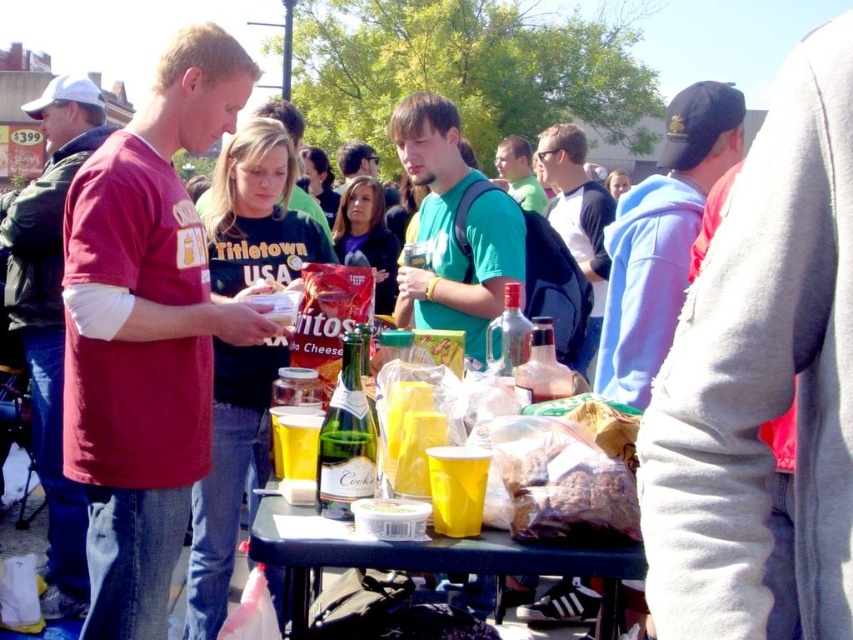
Is gray fleece sweatshirt at upper right below blue plastic table at center?

Incorrect, gray fleece sweatshirt at upper right is not positioned below blue plastic table at center.

Between gray fleece sweatshirt at upper right and blue plastic table at center, which one is positioned higher?

Positioned higher is gray fleece sweatshirt at upper right.

Which is behind, point (840, 188) or point (618, 572)?

Point (618, 572)

Where is `gray fleece sweatshirt at upper right`? This screenshot has height=640, width=853. gray fleece sweatshirt at upper right is located at coordinates (762, 378).

Does green matte shirt at center appear on the left side of green glass bottle at center?

No, green matte shirt at center is not to the left of green glass bottle at center.

Based on the photo, does green matte shirt at center have a lesser width compared to green glass bottle at center?

In fact, green matte shirt at center might be wider than green glass bottle at center.

Is point (486, 212) farther from viewer compared to point (334, 490)?

That is True.

The height and width of the screenshot is (640, 853). What are the coordinates of `green matte shirt at center` in the screenshot? It's located at point(453,227).

Which is more to the right, green glass bottle at center or green t-shirt at center?

green t-shirt at center

Looking at this image, between green glass bottle at center and green t-shirt at center, which one is positioned lower?

green glass bottle at center

Measure the distance between point (335,468) and camera.

They are 5.04 meters apart.

Where is `green glass bottle at center`? This screenshot has width=853, height=640. green glass bottle at center is located at coordinates (346, 440).